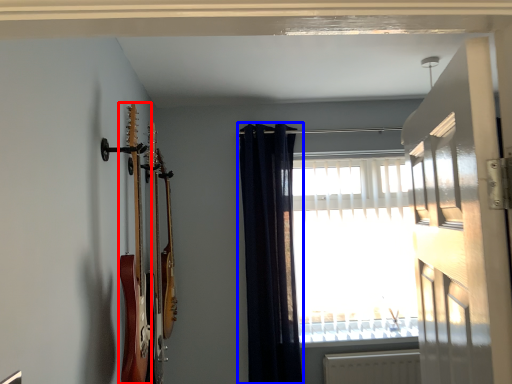
Question: Among these objects, which one is nearest to the camera, guitar (highlighted by a red box) or curtain (highlighted by a blue box)?

Choices:
 (A) guitar
 (B) curtain

Answer: (A)